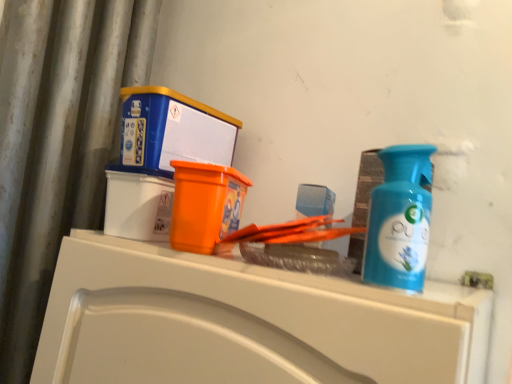
The image size is (512, 384). What do you see at coordinates (400, 219) in the screenshot? I see `blue plastic bottle at right` at bounding box center [400, 219].

At what (x,y) coordinates should I click in order to perform the action: click on blue plastic box at upper left. Please return your answer as a coordinate pair (x, y). The height and width of the screenshot is (384, 512). Looking at the image, I should click on (173, 130).

Is blue plastic bottle at right facing away from blue plastic box at upper left?

No, blue plastic bottle at right is not facing away from blue plastic box at upper left.

Locate an element on the screen. This screenshot has height=384, width=512. bottle on the right of blue plastic box at upper left is located at coordinates (400, 219).

Can you tell me how much blue plastic bottle at right and blue plastic box at upper left differ in facing direction?

The angular difference between blue plastic bottle at right and blue plastic box at upper left is 0.0059 degrees.

Can you confirm if blue plastic bottle at right is positioned to the left of blue plastic box at upper left?

No.

From the image's perspective, is blue plastic box at upper left beneath white glossy counter at upper center?

Actually, blue plastic box at upper left appears above white glossy counter at upper center in the image.

Considering the relative sizes of blue plastic box at upper left and white glossy counter at upper center in the image provided, is blue plastic box at upper left smaller than white glossy counter at upper center?

Yes.

How many degrees apart are the facing directions of blue plastic box at upper left and white glossy counter at upper center?

The angular difference between blue plastic box at upper left and white glossy counter at upper center is 0.000397 degrees.

Image resolution: width=512 pixels, height=384 pixels. What are the coordinates of `box behind the white glossy counter at upper center` in the screenshot? It's located at (173, 130).

Considering the sizes of white glossy counter at upper center and blue plastic box at upper left in the image, is white glossy counter at upper center bigger or smaller than blue plastic box at upper left?

white glossy counter at upper center is bigger than blue plastic box at upper left.

Can you confirm if white glossy counter at upper center is taller than blue plastic box at upper left?

Correct, white glossy counter at upper center is much taller as blue plastic box at upper left.

Is blue plastic box at upper left located within white glossy counter at upper center?

Definitely not — blue plastic box at upper left is not inside white glossy counter at upper center.

Are white glossy counter at upper center and blue plastic box at upper left making contact?

No, white glossy counter at upper center is not making contact with blue plastic box at upper left.

From the picture: Is blue plastic box at upper left bigger or smaller than blue plastic bottle at right?

Clearly, blue plastic box at upper left is larger in size than blue plastic bottle at right.

What's the angular difference between blue plastic box at upper left and blue plastic bottle at right's facing directions?

They differ by 0.0059 degrees in their facing directions.

Could you tell me if blue plastic box at upper left is facing blue plastic bottle at right?

No, blue plastic box at upper left is not aimed at blue plastic bottle at right.

Which object is further away from the camera taking this photo, blue plastic box at upper left or blue plastic bottle at right?

blue plastic box at upper left is further away from the camera.

Would you say blue plastic bottle at right is a long distance from white glossy counter at upper center?

No, blue plastic bottle at right is in close proximity to white glossy counter at upper center.

Which object is positioned more to the left, blue plastic bottle at right or white glossy counter at upper center?

white glossy counter at upper center is more to the left.

Is point (421, 259) farther from camera compared to point (71, 352)?

No.

From a real-world perspective, relative to blue plastic bottle at right, is white glossy counter at upper center vertically above or below?

white glossy counter at upper center is situated lower than blue plastic bottle at right in the real world.

What's the angular difference between white glossy counter at upper center and blue plastic bottle at right's facing directions?

0.00622 degrees separate the facing orientations of white glossy counter at upper center and blue plastic bottle at right.

In the scene shown: Can you confirm if white glossy counter at upper center is positioned to the right of blue plastic bottle at right?

Incorrect, white glossy counter at upper center is not on the right side of blue plastic bottle at right.

How distant is white glossy counter at upper center from blue plastic bottle at right?

white glossy counter at upper center and blue plastic bottle at right are 8.44 inches apart.

Locate an element on the screen. This screenshot has height=384, width=512. box located behind the blue plastic bottle at right is located at coordinates (173, 130).

Identify the location of counter on the right of blue plastic box at upper left. (246, 322).

Estimate the real-world distances between objects in this image. Which object is closer to blue plastic bottle at right, white glossy counter at upper center or blue plastic box at upper left?

Based on the image, white glossy counter at upper center appears to be nearer to blue plastic bottle at right.

From the image, which object appears to be farther from white glossy counter at upper center, blue plastic bottle at right or blue plastic box at upper left?

blue plastic box at upper left lies further to white glossy counter at upper center than the other object.

Which object lies nearer to the anchor point blue plastic box at upper left, white glossy counter at upper center or blue plastic bottle at right?

The object closer to blue plastic box at upper left is white glossy counter at upper center.

Considering their positions, is blue plastic bottle at right positioned closer to blue plastic box at upper left than white glossy counter at upper center?

white glossy counter at upper center is positioned closer to the anchor blue plastic box at upper left.

From the image, which object appears to be nearer to blue plastic bottle at right, blue plastic box at upper left or white glossy counter at upper center?

white glossy counter at upper center lies closer to blue plastic bottle at right than the other object.

Based on their spatial positions, is blue plastic box at upper left or blue plastic bottle at right closer to white glossy counter at upper center?

blue plastic bottle at right lies closer to white glossy counter at upper center than the other object.

You are a GUI agent. You are given a task and a screenshot of the screen. Output one action in this format:
    pyautogui.click(x=<x>, y=<y>)
    Task: Click on the bottle between white glossy counter at upper center and blue plastic box at upper left from front to back
    
    Given the screenshot: What is the action you would take?
    pyautogui.click(x=400, y=219)